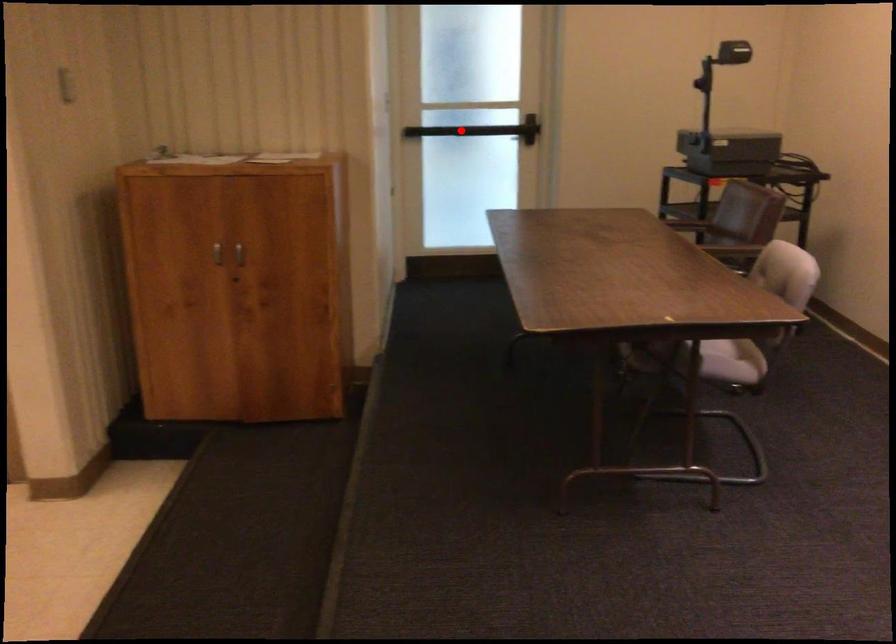
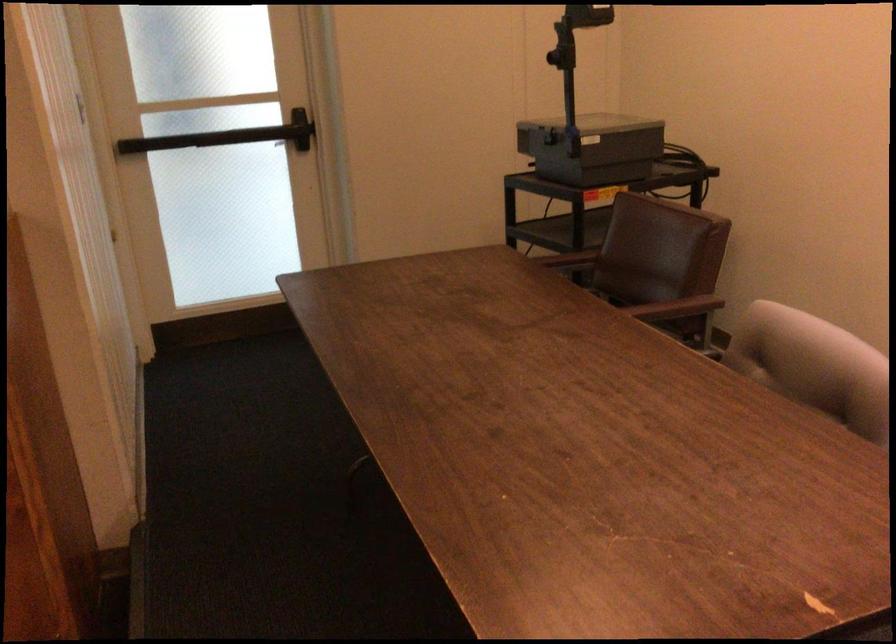
In the second image, find the point that corresponds to the highlighted location in the first image.

(207, 138)